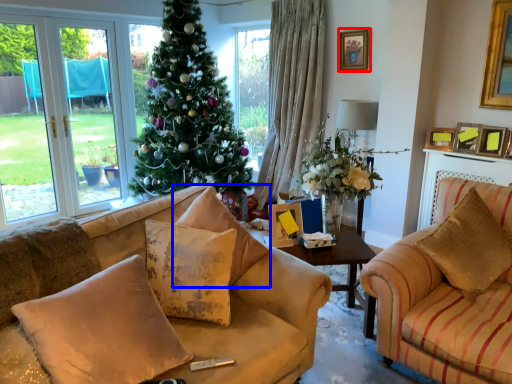
Question: Which object is further to the camera taking this photo, picture frame (highlighted by a red box) or pillow (highlighted by a blue box)?

Choices:
 (A) picture frame
 (B) pillow

Answer: (A)